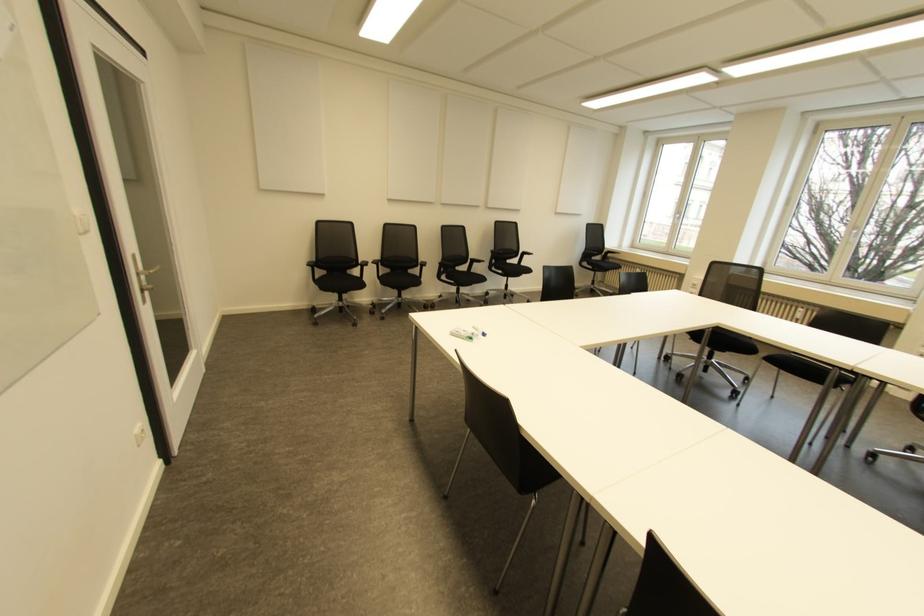
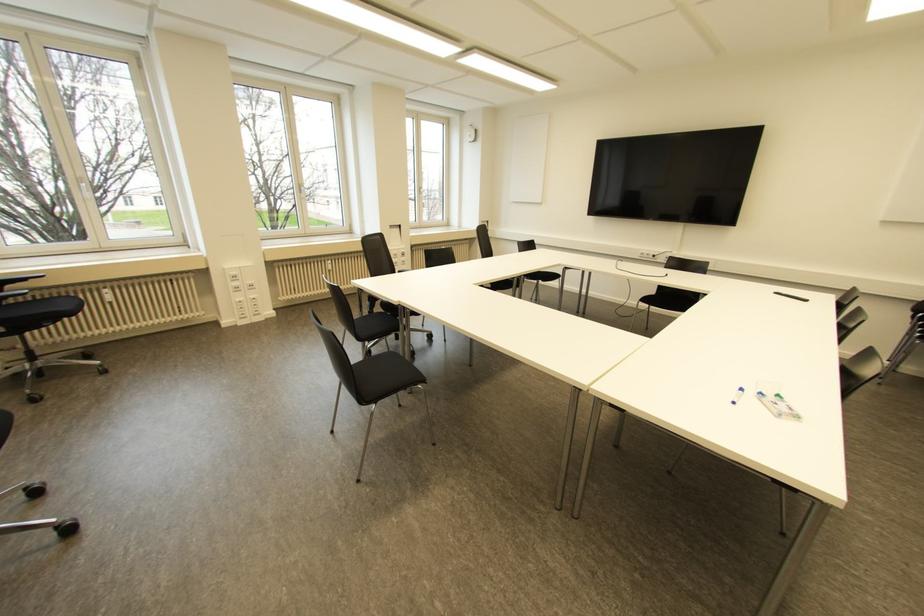
In the second image, find the point that corresponds to (x=483, y=334) in the first image.

(739, 390)